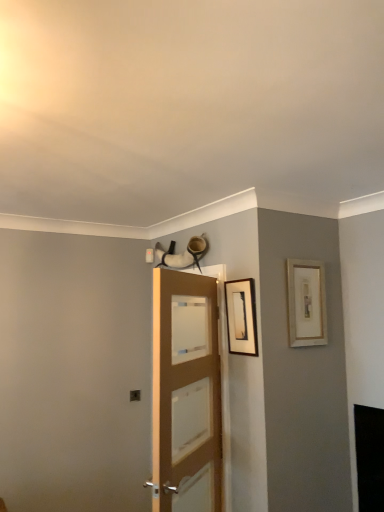
The height and width of the screenshot is (512, 384). I want to click on light brown wooden door at center, so click(x=186, y=390).

From a real-world perspective, is gold-framed picture at upper right, the second picture frame when ordered from left to right, positioned above or below matte black picture frame at upper center, the 1th picture frame in the left-to-right sequence?

In terms of real-world spatial position, gold-framed picture at upper right, the second picture frame when ordered from left to right, is above matte black picture frame at upper center, the 1th picture frame in the left-to-right sequence.

What are the coordinates of `picture frame on the right of matte black picture frame at upper center, the 1th picture frame in the left-to-right sequence` in the screenshot? It's located at (306, 303).

Is gold-framed picture at upper right, which is counted as the 1th picture frame, starting from the right, inside or outside of matte black picture frame at upper center, the 1th picture frame in the left-to-right sequence?

gold-framed picture at upper right, which is counted as the 1th picture frame, starting from the right, is spatially situated outside matte black picture frame at upper center, the 1th picture frame in the left-to-right sequence.

Measure the distance between gold-framed picture at upper right, which is counted as the 1th picture frame, starting from the right, and light brown wooden door at center.

gold-framed picture at upper right, which is counted as the 1th picture frame, starting from the right, is 61.63 centimeters from light brown wooden door at center.

Starting from the light brown wooden door at center, which picture frame is the 2nd one to the right? Please provide its 2D coordinates.

[(306, 303)]

Which object is positioned more to the left, gold-framed picture at upper right, the second picture frame when ordered from left to right, or light brown wooden door at center?

From the viewer's perspective, light brown wooden door at center appears more on the left side.

Considering the relative sizes of matte black picture frame at upper center, which is counted as the 2th picture frame, starting from the right, and gold-framed picture at upper right, which is counted as the 1th picture frame, starting from the right, in the image provided, is matte black picture frame at upper center, which is counted as the 2th picture frame, starting from the right, thinner than gold-framed picture at upper right, which is counted as the 1th picture frame, starting from the right,?

No, matte black picture frame at upper center, which is counted as the 2th picture frame, starting from the right, is not thinner than gold-framed picture at upper right, which is counted as the 1th picture frame, starting from the right.

In the image, there is a gold-framed picture at upper right, which is counted as the 1th picture frame, starting from the right. Identify the location of picture frame below it (from the image's perspective). This screenshot has width=384, height=512. (241, 317).

Which is behind, point (234, 334) or point (324, 317)?

The point (324, 317) is more distant.

Between point (176, 391) and point (233, 309), which one is positioned behind?

The point (233, 309) is behind.

Is light brown wooden door at center inside or outside of matte black picture frame at upper center, the 1th picture frame in the left-to-right sequence?

light brown wooden door at center lies outside matte black picture frame at upper center, the 1th picture frame in the left-to-right sequence.

Considering the relative sizes of light brown wooden door at center and matte black picture frame at upper center, which is counted as the 2th picture frame, starting from the right, in the image provided, is light brown wooden door at center taller than matte black picture frame at upper center, which is counted as the 2th picture frame, starting from the right,?

Indeed, light brown wooden door at center has a greater height compared to matte black picture frame at upper center, which is counted as the 2th picture frame, starting from the right.

How distant is light brown wooden door at center from matte black picture frame at upper center, which is counted as the 2th picture frame, starting from the right?

They are 13.92 inches apart.

From the picture: Which object is closer to the camera taking this photo, light brown wooden door at center or gold-framed picture at upper right, the second picture frame when ordered from left to right?

light brown wooden door at center.

Is light brown wooden door at center not within gold-framed picture at upper right, which is counted as the 1th picture frame, starting from the right?

light brown wooden door at center lies outside gold-framed picture at upper right, which is counted as the 1th picture frame, starting from the right,'s area.

From the image's perspective, is light brown wooden door at center on top of gold-framed picture at upper right, which is counted as the 1th picture frame, starting from the right?

No, from the image's perspective, light brown wooden door at center is not above gold-framed picture at upper right, which is counted as the 1th picture frame, starting from the right.

Between light brown wooden door at center and gold-framed picture at upper right, which is counted as the 1th picture frame, starting from the right, which one has larger size?

light brown wooden door at center is bigger.

Considering the positions of points (243, 286) and (148, 483), is point (243, 286) closer to camera compared to point (148, 483)?

That is False.

In the scene shown: From a real-world perspective, which is physically below, matte black picture frame at upper center, the 1th picture frame in the left-to-right sequence, or light brown wooden door at center?

From a 3D spatial view, light brown wooden door at center is below.

Which object is more forward, matte black picture frame at upper center, which is counted as the 2th picture frame, starting from the right, or light brown wooden door at center?

light brown wooden door at center is in front.

Is light brown wooden door at center located within matte black picture frame at upper center, which is counted as the 2th picture frame, starting from the right?

No, light brown wooden door at center is not inside matte black picture frame at upper center, which is counted as the 2th picture frame, starting from the right.

This screenshot has height=512, width=384. Find the location of `picture frame in front of the gold-framed picture at upper right, the second picture frame when ordered from left to right`. picture frame in front of the gold-framed picture at upper right, the second picture frame when ordered from left to right is located at coordinates (241, 317).

Locate an element on the screen. The height and width of the screenshot is (512, 384). the 2nd picture frame to the right of the light brown wooden door at center, counting from the anchor's position is located at coordinates (306, 303).

Which object lies nearer to the anchor point gold-framed picture at upper right, which is counted as the 1th picture frame, starting from the right, light brown wooden door at center or matte black picture frame at upper center, the 1th picture frame in the left-to-right sequence?

matte black picture frame at upper center, the 1th picture frame in the left-to-right sequence, lies closer to gold-framed picture at upper right, which is counted as the 1th picture frame, starting from the right, than the other object.

Considering their positions, is gold-framed picture at upper right, the second picture frame when ordered from left to right, positioned further to matte black picture frame at upper center, which is counted as the 2th picture frame, starting from the right, than light brown wooden door at center?

Among the two, light brown wooden door at center is located further to matte black picture frame at upper center, which is counted as the 2th picture frame, starting from the right.

Consider the image. Based on their spatial positions, is matte black picture frame at upper center, the 1th picture frame in the left-to-right sequence, or light brown wooden door at center further from gold-framed picture at upper right, which is counted as the 1th picture frame, starting from the right?

light brown wooden door at center lies further to gold-framed picture at upper right, which is counted as the 1th picture frame, starting from the right, than the other object.

Considering their positions, is gold-framed picture at upper right, the second picture frame when ordered from left to right, positioned further to light brown wooden door at center than matte black picture frame at upper center, which is counted as the 2th picture frame, starting from the right?

The object further to light brown wooden door at center is gold-framed picture at upper right, the second picture frame when ordered from left to right.

Estimate the real-world distances between objects in this image. Which object is closer to light brown wooden door at center, matte black picture frame at upper center, which is counted as the 2th picture frame, starting from the right, or gold-framed picture at upper right, which is counted as the 1th picture frame, starting from the right?

matte black picture frame at upper center, which is counted as the 2th picture frame, starting from the right, lies closer to light brown wooden door at center than the other object.

When comparing their distances from matte black picture frame at upper center, which is counted as the 2th picture frame, starting from the right, does light brown wooden door at center or gold-framed picture at upper right, which is counted as the 1th picture frame, starting from the right, seem further?

light brown wooden door at center is further to matte black picture frame at upper center, which is counted as the 2th picture frame, starting from the right.

The width and height of the screenshot is (384, 512). I want to click on picture frame between light brown wooden door at center and gold-framed picture at upper right, which is counted as the 1th picture frame, starting from the right, in the horizontal direction, so click(241, 317).